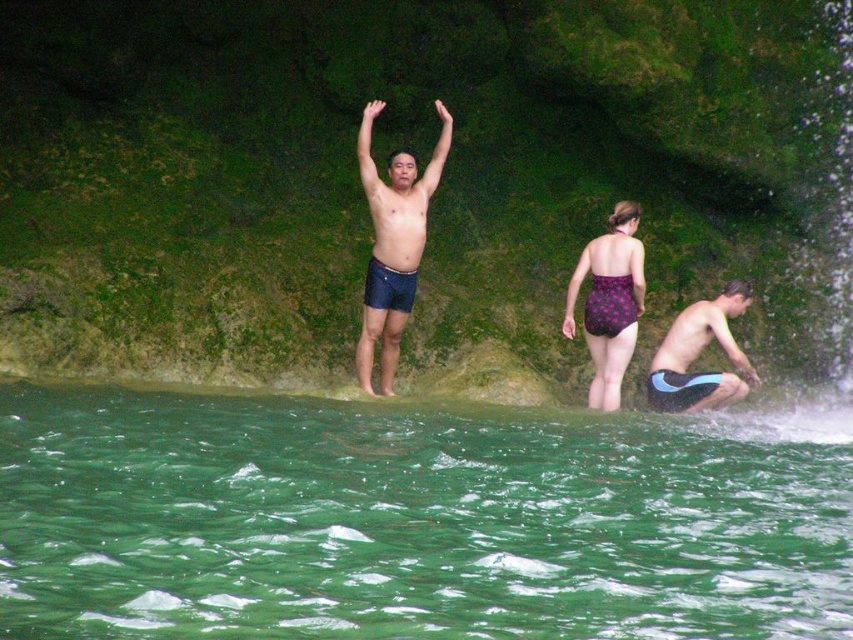
You are a photographer trying to capture the scene of the green translucent water at lower center and the dark blue shorts at center. Which object in the scene would you focus on first if you want to ensure both are in frame?

The green translucent water at lower center is bigger than the dark blue shorts at center, so you should focus on the green translucent water at lower center first to ensure both are in frame.

You are a photographer standing at the edge of the pool. You want to capture a photo that includes both the green translucent water at lower center and the dark blue swim trunks at center. Which object should you frame first to ensure both are in the shot?

The green translucent water at lower center is wider than the dark blue swim trunks at center, so you should frame the green translucent water at lower center first to ensure both are included in the photo.